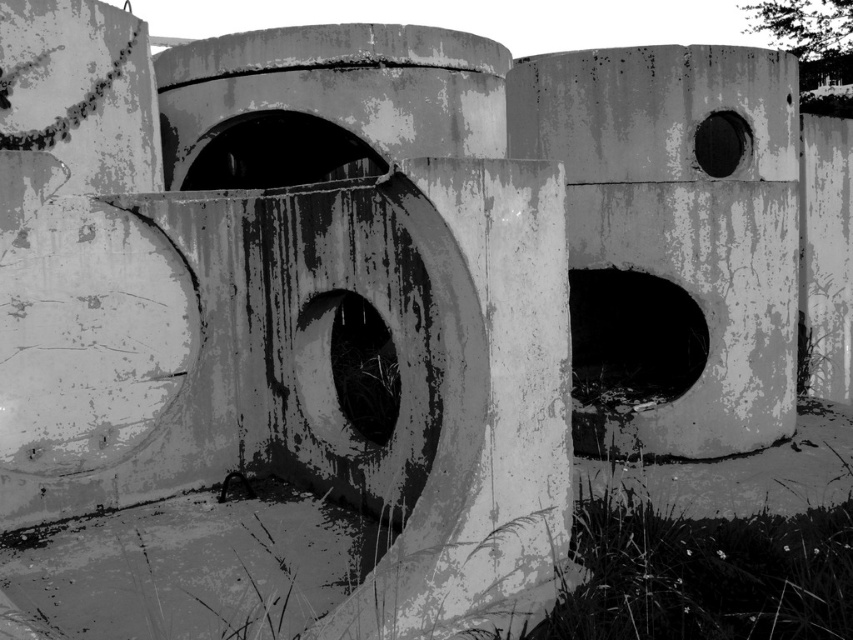
Is rusty concrete pillar at center to the left of concrete wall at center from the viewer's perspective?

Correct, you'll find rusty concrete pillar at center to the left of concrete wall at center.

At what (x,y) coordinates should I click in order to perform the action: click on rusty concrete pillar at center. Please return your answer as a coordinate pair (x, y). Looking at the image, I should click on (434, 285).

Between point (491, 122) and point (796, 268), which one is positioned in front?

Point (796, 268)

The height and width of the screenshot is (640, 853). Find the location of `rusty concrete pillar at center`. rusty concrete pillar at center is located at coordinates (434, 285).